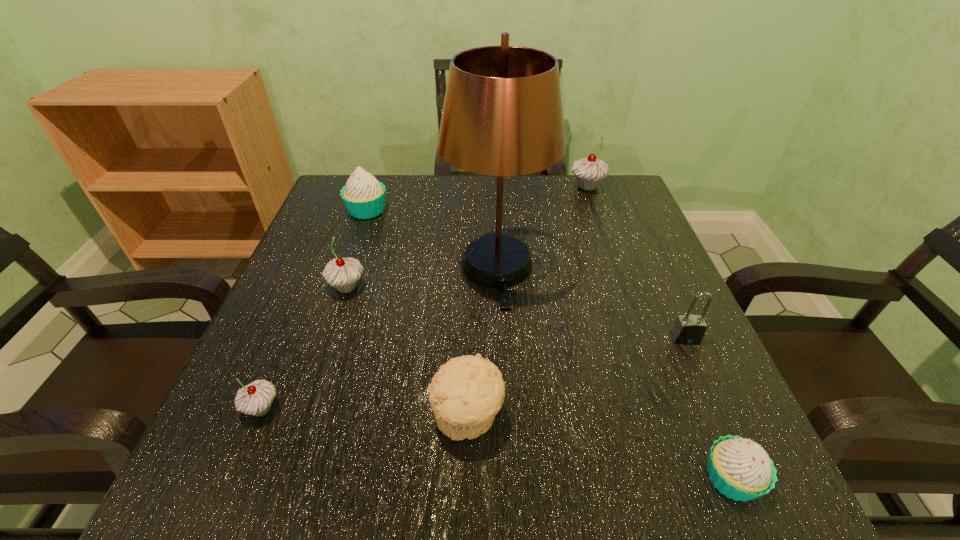
Locate an element on the screen. the leftmost gray cupcake is located at coordinates (256, 398).

Identify the location of the smallest gray cupcake. (256, 398).

At what (x,y) coordinates should I click in order to perform the action: click on the smaller white cupcake. Please return your answer as a coordinate pair (x, y). The width and height of the screenshot is (960, 540). Looking at the image, I should click on (741, 469).

Find the location of a particular element. the nearest cupcake is located at coordinates (741, 469).

You are a GUI agent. You are given a task and a screenshot of the screen. Output one action in this format:
    pyautogui.click(x=<x>, y=<y>)
    Task: Click on the free spot located on the front-facing side of the tallest object
    
    Given the screenshot: What is the action you would take?
    pyautogui.click(x=507, y=470)

Locate an element on the screen. blank area located on the left of the tallest cupcake is located at coordinates (517, 186).

This screenshot has height=540, width=960. I want to click on blank area located 0.270m on the back of the third farthest cupcake, so click(x=373, y=205).

The height and width of the screenshot is (540, 960). I want to click on vacant position located on the right of the left white cupcake, so click(x=527, y=210).

I want to click on free space located 0.100m on the shackle of the padlock, so click(x=709, y=393).

Locate an element on the screen. The image size is (960, 540). vacant space located 0.300m on the left of the beige muffin is located at coordinates (238, 417).